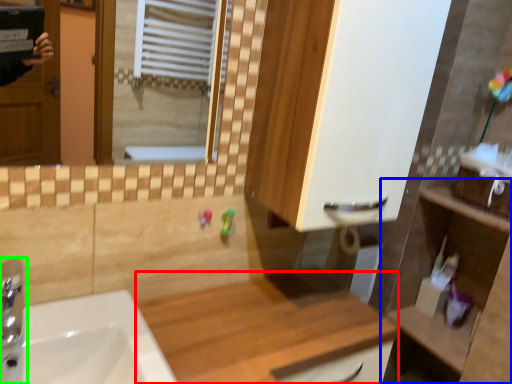
Question: Estimate the real-world distances between objects in this image. Which object is farther from counter top (highlighted by a red box), counter (highlighted by a blue box) or tap (highlighted by a green box)?

Choices:
 (A) counter
 (B) tap

Answer: (B)